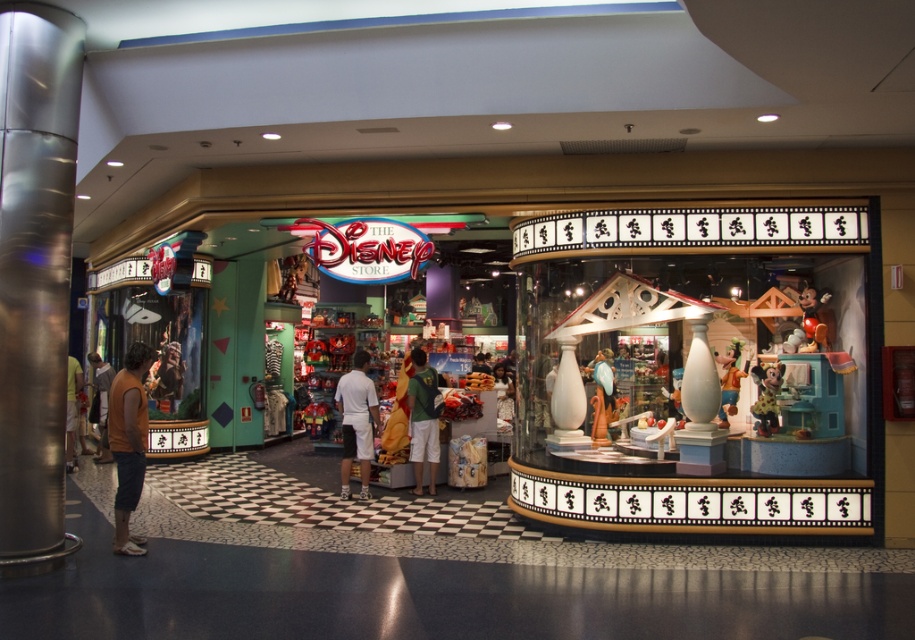
You are a customer at The Disney Store entrance and see two shirts displayed in the glass display case. The orange sleeveless shirt at left and the matte brown shirt at left. Which shirt is located more to the right side within the display case?

The orange sleeveless shirt at left is positioned on the right side of matte brown shirt at left, so the orange sleeveless shirt at left is more to the right side within the display case.

You are a customer standing in front of the Disney Store entrance. You see the white cotton shorts at center and the shiny gold mickey mouse statue at center displayed in the glass display case. Which item is closer to you?

The white cotton shorts at center is closer to you because it is further to the viewer than the shiny gold mickey mouse statue at center.

You are standing in front of the Disney Store entrance and notice two points marked on the glass display case. The first point is at coordinates point (x=111, y=420) and the second is at point (x=70, y=362). Which point is closer to you?

Point (x=111, y=420) is closer to the viewer than point (x=70, y=362).